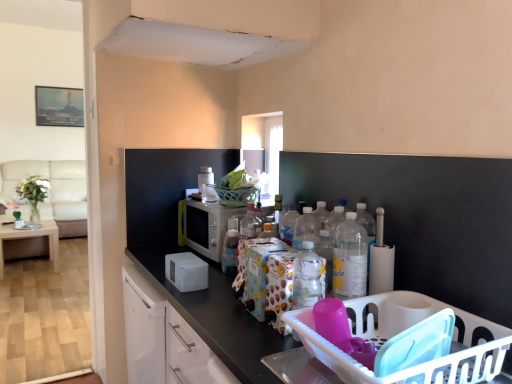
Question: Considering the relative sizes of white plastic toaster at upper center, the 2th appliance from the bottom, and translucent plastic bottle at center, the 2th bottle when ordered from front to back, in the image provided, is white plastic toaster at upper center, the 2th appliance from the bottom, wider than translucent plastic bottle at center, the 2th bottle when ordered from front to back,?

Choices:
 (A) yes
 (B) no

Answer: (A)

Question: Is white plastic toaster at upper center, the 2th appliance from the bottom, next to translucent plastic bottle at center, the second bottle viewed from the right?

Choices:
 (A) no
 (B) yes

Answer: (A)

Question: From the image's perspective, does white plastic toaster at upper center, the 2th appliance from the bottom, appear lower than translucent plastic bottle at center, the 2th bottle when ordered from front to back?

Choices:
 (A) no
 (B) yes

Answer: (A)

Question: From a real-world perspective, is white plastic toaster at upper center, the 2th appliance from the bottom, beneath translucent plastic bottle at center, which appears as the 1th bottle when viewed from the back?

Choices:
 (A) no
 (B) yes

Answer: (A)

Question: Is white plastic toaster at upper center, which is counted as the first appliance, starting from the top, located outside translucent plastic bottle at center, the second bottle viewed from the right?

Choices:
 (A) yes
 (B) no

Answer: (A)

Question: Is beige fabric couch at left in front of or behind transparent glass window at center in the image?

Choices:
 (A) front
 (B) behind

Answer: (B)

Question: From the image's perspective, is beige fabric couch at left positioned above or below transparent glass window at center?

Choices:
 (A) above
 (B) below

Answer: (B)

Question: From a real-world perspective, relative to transparent glass window at center, is beige fabric couch at left vertically above or below?

Choices:
 (A) above
 (B) below

Answer: (B)

Question: Based on their positions, is beige fabric couch at left located to the left or right of transparent glass window at center?

Choices:
 (A) right
 (B) left

Answer: (B)

Question: Would you say green leafy plant in clear vase at left is inside or outside white plastic basket at lower right?

Choices:
 (A) outside
 (B) inside

Answer: (A)

Question: Considering the positions of green leafy plant in clear vase at left and white plastic basket at lower right in the image, is green leafy plant in clear vase at left wider or thinner than white plastic basket at lower right?

Choices:
 (A) wide
 (B) thin

Answer: (B)

Question: Visually, is green leafy plant in clear vase at left positioned to the left or to the right of white plastic basket at lower right?

Choices:
 (A) left
 (B) right

Answer: (A)

Question: Is point (26, 193) positioned closer to the camera than point (373, 329)?

Choices:
 (A) closer
 (B) farther

Answer: (B)

Question: From the image's perspective, is green leafy plant in clear vase at left positioned above or below clear plastic bottle at center-right, which is the 1th bottle from right to left?

Choices:
 (A) below
 (B) above

Answer: (B)

Question: Considering their positions, is green leafy plant in clear vase at left located in front of or behind clear plastic bottle at center-right, the second bottle positioned from the back?

Choices:
 (A) front
 (B) behind

Answer: (B)